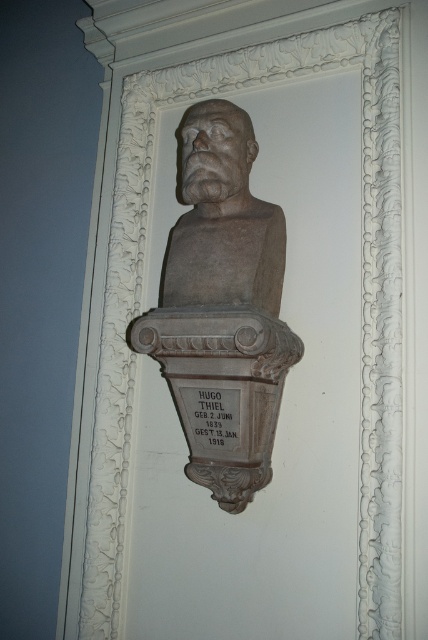
Question: Is gray stone bust at center to the left of matte stone bust at center from the viewer's perspective?

Choices:
 (A) yes
 (B) no

Answer: (B)

Question: Does gray stone bust at center appear under matte stone bust at center?

Choices:
 (A) yes
 (B) no

Answer: (A)

Question: Which object appears farthest from the camera in this image?

Choices:
 (A) matte stone bust at center
 (B) gray stone bust at center

Answer: (A)

Question: Is gray stone bust at center below matte stone bust at center?

Choices:
 (A) no
 (B) yes

Answer: (B)